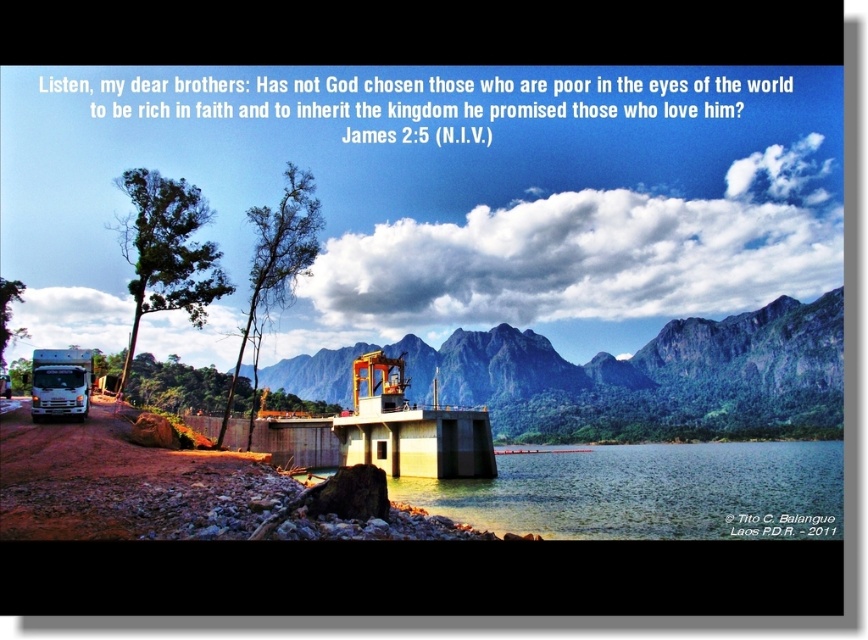
You are a hiker who wants to take a photo of the green rock mountain at center from the white glossy truck at lower left. Which direction should you face to capture the mountain in your shot?

To photograph the green rock mountain at center from the white glossy truck at lower left, you should face towards the right since the green rock mountain at center is positioned to the right of the white glossy truck at lower left.

You are a hiker standing at the dirt road near the white glossy truck at lower left. You want to reach the concrete structure with the yellow roof in the distance. Which direction should you walk to avoid the clear water at lower center?

To avoid the clear water at lower center, you should walk to the left along the dirt road since the clear water at lower center is to the right of the white glossy truck at lower left, meaning the water is between the truck and the structure. Walking left would keep you on the road away from the water.

You are standing at the concrete structure with the yellow roof and want to take a photo of both point (836, 516) and point (68, 349) in the image. Since you can only focus on one point at a time, which point should you focus on to ensure the other point is still in the background?

You should focus on point (836, 516) because it is closer to the camera than point (68, 349). This way, the farther point will naturally be in the background.